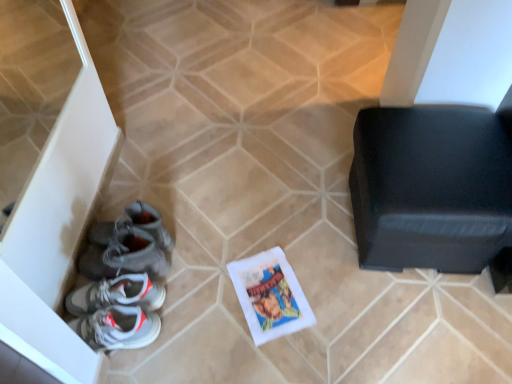
Question: From the image's perspective, is white paper comic book at center beneath black leather ottoman at right?

Choices:
 (A) no
 (B) yes

Answer: (B)

Question: Is black leather ottoman at right inside white paper comic book at center?

Choices:
 (A) no
 (B) yes

Answer: (A)

Question: Is white paper comic book at center thinner than black leather ottoman at right?

Choices:
 (A) yes
 (B) no

Answer: (A)

Question: From the image's perspective, is white paper comic book at center located above black leather ottoman at right?

Choices:
 (A) no
 (B) yes

Answer: (A)

Question: Is white paper comic book at center completely or partially outside of black leather ottoman at right?

Choices:
 (A) no
 (B) yes

Answer: (B)

Question: From the image's perspective, relative to black leather ottoman at right, is white paper comic book at center above or below?

Choices:
 (A) below
 (B) above

Answer: (A)

Question: In the image, is white paper comic book at center positioned in front of or behind black leather ottoman at right?

Choices:
 (A) front
 (B) behind

Answer: (B)

Question: Looking at the image, does white paper comic book at center seem bigger or smaller compared to black leather ottoman at right?

Choices:
 (A) small
 (B) big

Answer: (A)

Question: Considering the positions of point (266, 278) and point (431, 124), is point (266, 278) closer or farther from the camera than point (431, 124)?

Choices:
 (A) closer
 (B) farther

Answer: (B)

Question: Looking at their shapes, would you say white paper comic book at center is wider or thinner than gray suede sneakers at lower left?

Choices:
 (A) thin
 (B) wide

Answer: (A)

Question: Is white paper comic book at center to the left or to the right of gray suede sneakers at lower left in the image?

Choices:
 (A) left
 (B) right

Answer: (B)

Question: Relative to gray suede sneakers at lower left, is white paper comic book at center in front or behind?

Choices:
 (A) front
 (B) behind

Answer: (B)

Question: In terms of size, does white paper comic book at center appear bigger or smaller than gray suede sneakers at lower left?

Choices:
 (A) small
 (B) big

Answer: (A)

Question: From the image's perspective, relative to white paper comic book at center, is gray suede sneakers at lower left above or below?

Choices:
 (A) above
 (B) below

Answer: (A)

Question: Based on their sizes in the image, would you say gray suede sneakers at lower left is bigger or smaller than white paper comic book at center?

Choices:
 (A) big
 (B) small

Answer: (A)